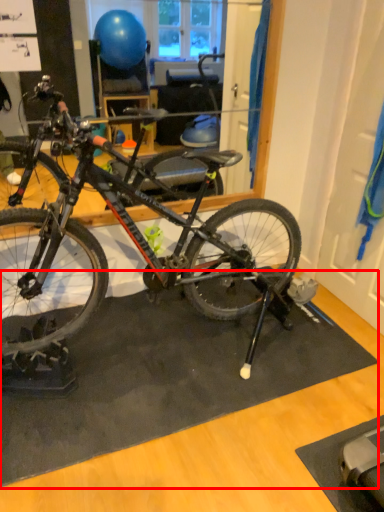
Question: From the image's perspective, where is doormat (annotated by the red box) located in relation to bicycle in the image?

Choices:
 (A) below
 (B) above

Answer: (A)